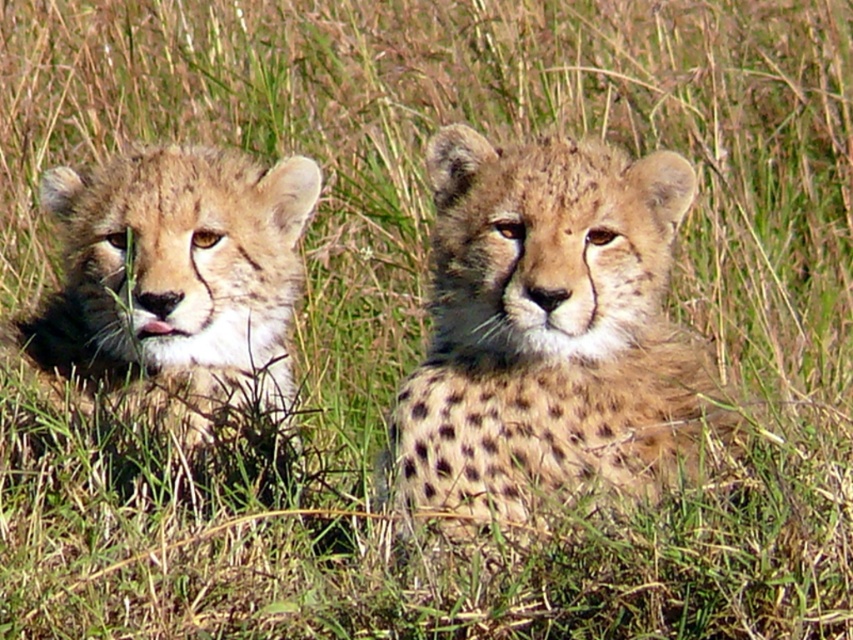
Question: Can you confirm if spotted fur cheetah at center is thinner than spotted fur cheetah at left?

Choices:
 (A) no
 (B) yes

Answer: (B)

Question: Which point is farther from the camera taking this photo?

Choices:
 (A) (596, 166)
 (B) (96, 189)

Answer: (B)

Question: Is spotted fur cheetah at center below spotted fur cheetah at left?

Choices:
 (A) no
 (B) yes

Answer: (B)

Question: Is spotted fur cheetah at center wider than spotted fur cheetah at left?

Choices:
 (A) yes
 (B) no

Answer: (B)